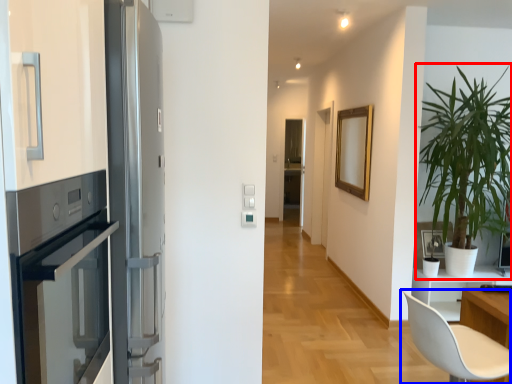
Question: Which point is closer to the camera, houseplant (highlighted by a red box) or chair (highlighted by a blue box)?

Choices:
 (A) houseplant
 (B) chair

Answer: (B)